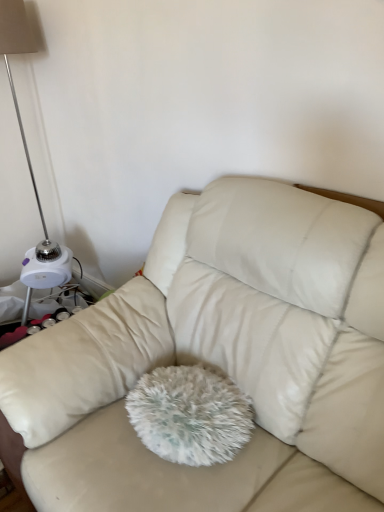
Find the location of a particular element. Image resolution: width=384 pixels, height=512 pixels. white plastic lamp at left is located at coordinates (29, 156).

This screenshot has height=512, width=384. What do you see at coordinates (29, 156) in the screenshot?
I see `white plastic lamp at left` at bounding box center [29, 156].

What do you see at coordinates (218, 361) in the screenshot?
I see `beige leather couch at center` at bounding box center [218, 361].

I want to click on beige leather couch at center, so click(218, 361).

Identify the location of white plastic lamp at left. (29, 156).

Does beige leather couch at center appear on the right side of white plastic lamp at left?

Indeed, beige leather couch at center is positioned on the right side of white plastic lamp at left.

Is beige leather couch at center positioned behind white plastic lamp at left?

No, beige leather couch at center is closer to the viewer.

Which point is more forward, [133,292] or [38,288]?

Positioned in front is point [133,292].

From the image's perspective, between beige leather couch at center and white plastic lamp at left, who is located below?

beige leather couch at center appears lower in the image.

From a real-world perspective, relative to white plastic lamp at left, is beige leather couch at center vertically above or below?

beige leather couch at center is below white plastic lamp at left.

Is beige leather couch at center wider than white plastic lamp at left?

Yes.

Considering the relative sizes of beige leather couch at center and white plastic lamp at left in the image provided, is beige leather couch at center shorter than white plastic lamp at left?

Correct, beige leather couch at center is not as tall as white plastic lamp at left.

Does beige leather couch at center have a smaller size compared to white plastic lamp at left?

Incorrect, beige leather couch at center is not smaller in size than white plastic lamp at left.

Can we say beige leather couch at center lies outside white plastic lamp at left?

beige leather couch at center lies outside white plastic lamp at left's area.

Is beige leather couch at center in contact with white plastic lamp at left?

No, beige leather couch at center is not with white plastic lamp at left.

Is beige leather couch at center looking in the opposite direction of white plastic lamp at left?

No, white plastic lamp at left is not at the back of beige leather couch at center.

How many degrees apart are the facing directions of beige leather couch at center and white plastic lamp at left?

91 degrees separate the facing orientations of beige leather couch at center and white plastic lamp at left.

Image resolution: width=384 pixels, height=512 pixels. I want to click on lamp lying on the left of beige leather couch at center, so click(x=29, y=156).

Is white plastic lamp at left to the left of beige leather couch at center from the viewer's perspective?

Yes, white plastic lamp at left is to the left of beige leather couch at center.

Considering the positions of objects white plastic lamp at left and beige leather couch at center in the image provided, who is in front, white plastic lamp at left or beige leather couch at center?

beige leather couch at center.

Considering the positions of points (23, 264) and (254, 388), is point (23, 264) farther from camera compared to point (254, 388)?

Yes, point (23, 264) is behind point (254, 388).

From the image's perspective, is white plastic lamp at left above or below beige leather couch at center?

Based on their image positions, white plastic lamp at left is located above beige leather couch at center.

From a real-world perspective, does white plastic lamp at left stand above beige leather couch at center?

Yes.

Considering the relative sizes of white plastic lamp at left and beige leather couch at center in the image provided, is white plastic lamp at left thinner than beige leather couch at center?

Yes, white plastic lamp at left is thinner than beige leather couch at center.

In terms of height, does white plastic lamp at left look taller or shorter compared to beige leather couch at center?

white plastic lamp at left is taller than beige leather couch at center.

Is white plastic lamp at left bigger than beige leather couch at center?

Actually, white plastic lamp at left might be smaller than beige leather couch at center.

Is beige leather couch at center surrounded by white plastic lamp at left?

No, beige leather couch at center is not surrounded by white plastic lamp at left.

Are white plastic lamp at left and beige leather couch at center located far from each other?

white plastic lamp at left is positioned a significant distance from beige leather couch at center.

Could you tell me if white plastic lamp at left is facing beige leather couch at center?

Yes, white plastic lamp at left is turned towards beige leather couch at center.

What's the angular difference between white plastic lamp at left and beige leather couch at center's facing directions?

They differ by 91 degrees in their facing directions.

Measure the distance between white plastic lamp at left and beige leather couch at center.

They are 3.67 feet apart.

The height and width of the screenshot is (512, 384). What are the coordinates of `studio couch beneath the white plastic lamp at left (from a real-world perspective)` in the screenshot? It's located at (218, 361).

Locate an element on the screen. studio couch beneath the white plastic lamp at left (from a real-world perspective) is located at coordinates (218, 361).

The height and width of the screenshot is (512, 384). I want to click on lamp that is on the left side of beige leather couch at center, so click(29, 156).